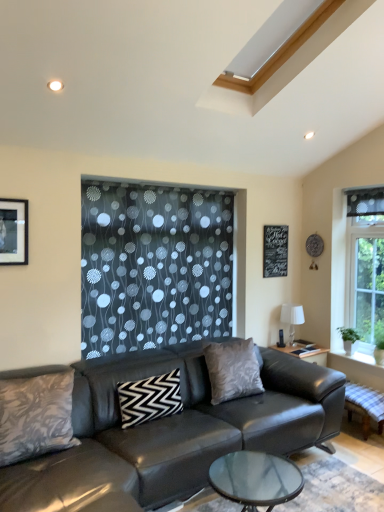
Question: Can you confirm if matte black picture frame at upper left is taller than black zigzag pillow at center, which is the second pillow in left-to-right order?

Choices:
 (A) yes
 (B) no

Answer: (A)

Question: Could you tell me if matte black picture frame at upper left is turned towards black zigzag pillow at center, placed as the second pillow when sorted from back to front?

Choices:
 (A) yes
 (B) no

Answer: (B)

Question: From the image's perspective, would you say matte black picture frame at upper left is shown under black zigzag pillow at center, which is counted as the 2th pillow, starting from the front?

Choices:
 (A) yes
 (B) no

Answer: (B)

Question: Considering the relative sizes of matte black picture frame at upper left and black zigzag pillow at center, the 2th pillow viewed from the right, in the image provided, is matte black picture frame at upper left smaller than black zigzag pillow at center, the 2th pillow viewed from the right,?

Choices:
 (A) yes
 (B) no

Answer: (A)

Question: Is matte black picture frame at upper left positioned with its back to black zigzag pillow at center, the 2th pillow viewed from the right?

Choices:
 (A) no
 (B) yes

Answer: (A)

Question: From the image's perspective, is leather couch at center positioned above or below matte black picture frame at upper left?

Choices:
 (A) below
 (B) above

Answer: (A)

Question: Considering the positions of leather couch at center and matte black picture frame at upper left in the image, is leather couch at center taller or shorter than matte black picture frame at upper left?

Choices:
 (A) short
 (B) tall

Answer: (B)

Question: Considering the positions of point (152, 440) and point (18, 243), is point (152, 440) closer or farther from the camera than point (18, 243)?

Choices:
 (A) closer
 (B) farther

Answer: (A)

Question: From a real-world perspective, relative to matte black picture frame at upper left, is leather couch at center vertically above or below?

Choices:
 (A) below
 (B) above

Answer: (A)

Question: From the image's perspective, is leather couch at center located above or below silky gray pillow at center, which is counted as the 3th pillow, starting from the front?

Choices:
 (A) below
 (B) above

Answer: (A)

Question: Is point (327, 392) positioned closer to the camera than point (256, 375)?

Choices:
 (A) farther
 (B) closer

Answer: (B)

Question: Considering the positions of leather couch at center and silky gray pillow at center, positioned as the 1th pillow in back-to-front order, in the image, is leather couch at center bigger or smaller than silky gray pillow at center, positioned as the 1th pillow in back-to-front order,?

Choices:
 (A) small
 (B) big

Answer: (B)

Question: In terms of width, does leather couch at center look wider or thinner when compared to silky gray pillow at center, placed as the 3th pillow when sorted from left to right?

Choices:
 (A) thin
 (B) wide

Answer: (B)

Question: Is leather couch at center bigger or smaller than white fabric lampshade at right?

Choices:
 (A) big
 (B) small

Answer: (A)

Question: Would you say leather couch at center is inside or outside white fabric lampshade at right?

Choices:
 (A) inside
 (B) outside

Answer: (B)